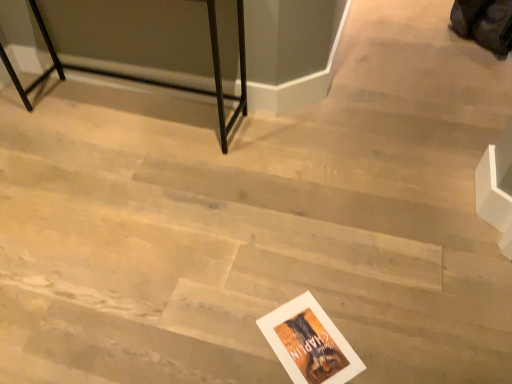
At what (x,y) coordinates should I click in order to perform the action: click on unoccupied space behind white paper postcard at lower center. Please return your answer as a coordinate pair (x, y). The height and width of the screenshot is (384, 512). Looking at the image, I should click on (304, 279).